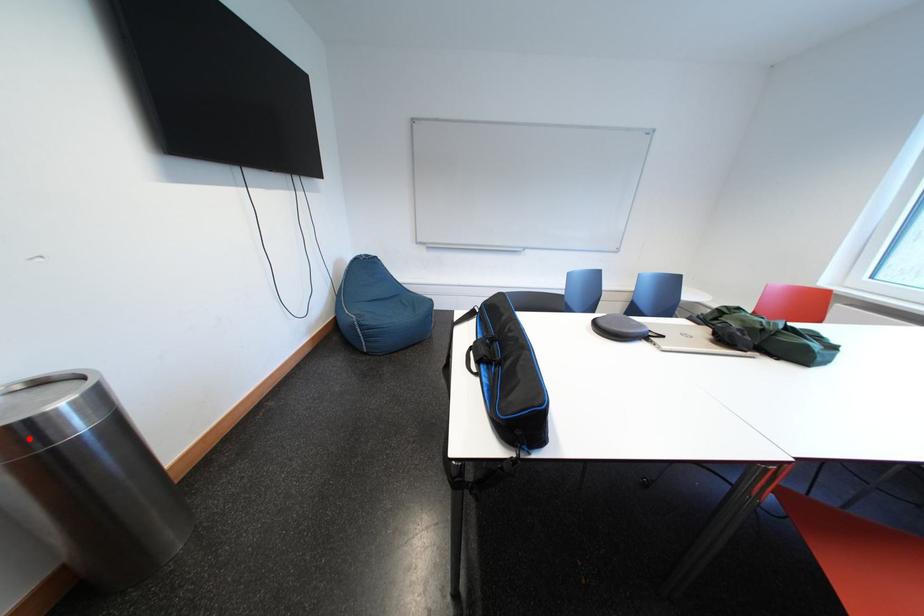
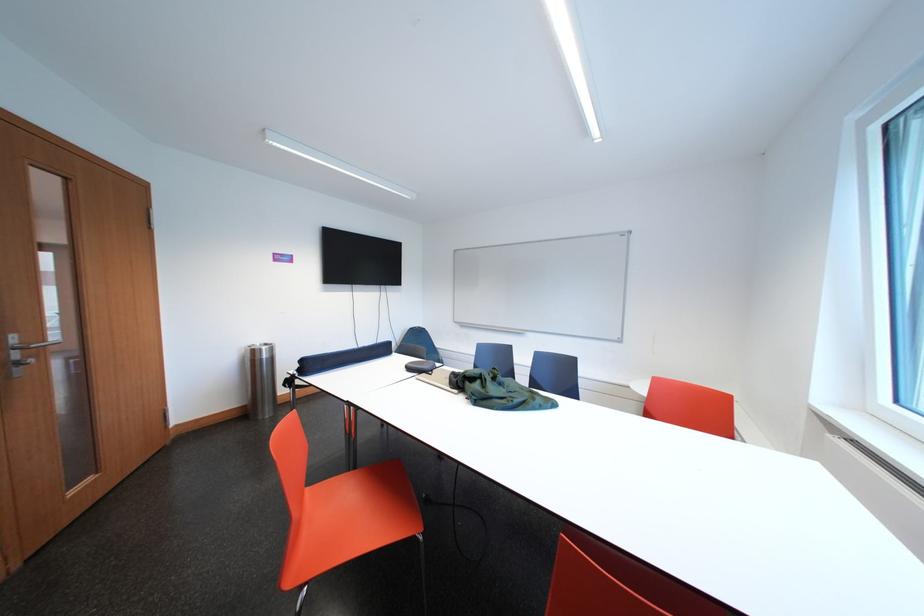
Question: I am providing you with two images of the same scene from different viewpoints. In image1, a red point is highlighted. Considering the same 3D point in image2, which of the following is correct?

Choices:
 (A) It is closer
 (B) It is farther

Answer: (B)